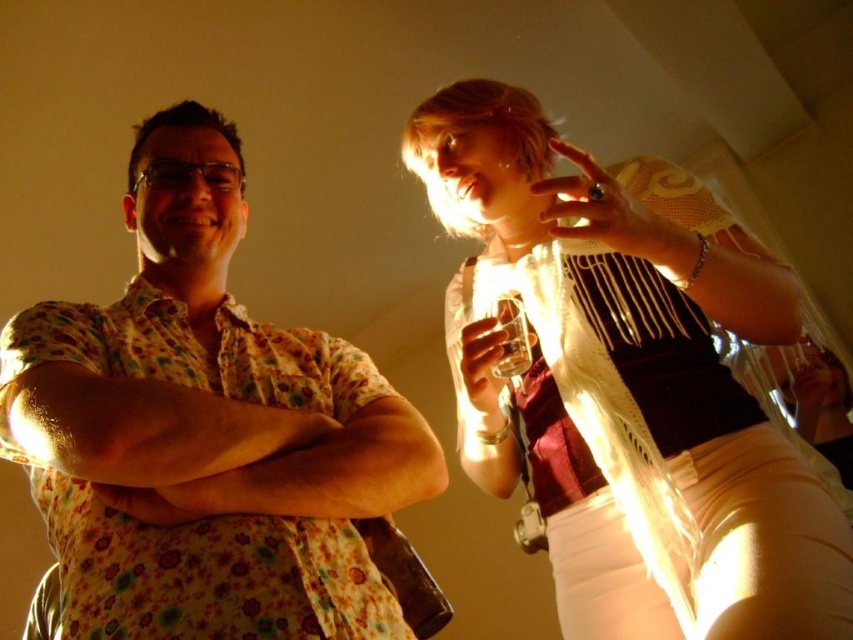
Question: Does matte white scarf at upper right lie in front of floral cotton shirt at left?

Choices:
 (A) no
 (B) yes

Answer: (B)

Question: Observing the image, what is the correct spatial positioning of matte white scarf at upper right in reference to floral cotton shirt at left?

Choices:
 (A) above
 (B) below

Answer: (B)

Question: Which of the following is the closest to the observer?

Choices:
 (A) (287, 364)
 (B) (408, 147)

Answer: (A)

Question: Is matte white scarf at upper right thinner than floral cotton shirt at left?

Choices:
 (A) no
 (B) yes

Answer: (A)

Question: Which of the following is the farthest from the observer?

Choices:
 (A) matte white scarf at upper right
 (B) floral cotton shirt at left

Answer: (B)